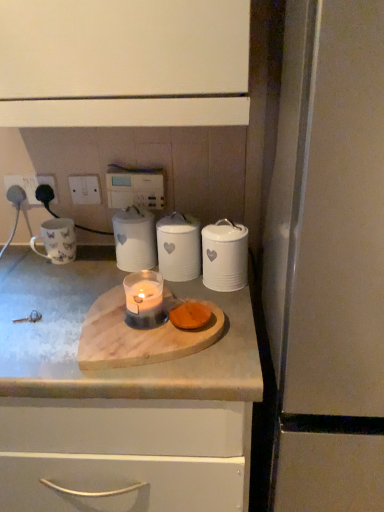
Question: From a real-world perspective, relative to wooden cutting board at center, is matte white mug at left vertically above or below?

Choices:
 (A) below
 (B) above

Answer: (B)

Question: Would you say matte white mug at left is to the left or to the right of wooden cutting board at center in the picture?

Choices:
 (A) right
 (B) left

Answer: (B)

Question: Considering the real-world distances, which object is farthest from the white ceramic canister at right, the 3th kitchen appliance when ordered from left to right?

Choices:
 (A) white glossy electric outlet at upper left, arranged as the 2th electric outlet when viewed from the left
 (B) wooden cutting board at center
 (C) white plastic socket at upper left, which is the 1th electric outlet in left-to-right order
 (D) translucent glass candle at center
 (E) matte white mug at left

Answer: (C)

Question: Estimate the real-world distances between objects in this image. Which object is farther from the white ceramic canister at center, marked as the 2th kitchen appliance in a left-to-right arrangement?

Choices:
 (A) translucent glass candle at center
 (B) wooden cutting board at center
 (C) white glossy electric outlet at upper left, which is the second electric outlet from right to left
 (D) white ceramic canister at center, the 1th kitchen appliance viewed from the left
 (E) white plastic electric outlet at upper left, which ranks as the 1th electric outlet in right-to-left order

Answer: (C)